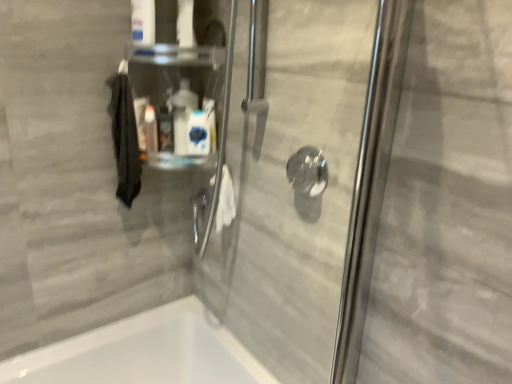
Question: From the image's perspective, is white glossy bottle at upper center, placed as the second cleaning product when sorted from right to left, over transparent glass shower handle at center?

Choices:
 (A) no
 (B) yes

Answer: (B)

Question: From the image's perspective, is white glossy bottle at upper center, placed as the second cleaning product when sorted from right to left, located beneath transparent glass shower handle at center?

Choices:
 (A) yes
 (B) no

Answer: (B)

Question: Are white glossy bottle at upper center, which ranks as the first cleaning product in left-to-right order, and transparent glass shower handle at center making contact?

Choices:
 (A) no
 (B) yes

Answer: (A)

Question: From a real-world perspective, does white glossy bottle at upper center, placed as the second cleaning product when sorted from right to left, sit lower than transparent glass shower handle at center?

Choices:
 (A) no
 (B) yes

Answer: (A)

Question: Is white glossy bottle at upper center, placed as the second cleaning product when sorted from right to left, positioned with its back to transparent glass shower handle at center?

Choices:
 (A) yes
 (B) no

Answer: (B)

Question: In terms of height, does white glossy bottle at center, which is the second cleaning product from left to right, look taller or shorter compared to black matte hand towel at left?

Choices:
 (A) tall
 (B) short

Answer: (B)

Question: Is point (188, 137) positioned closer to the camera than point (124, 168)?

Choices:
 (A) farther
 (B) closer

Answer: (B)

Question: Is white glossy bottle at center, the first cleaning product when ordered from right to left, bigger or smaller than black matte hand towel at left?

Choices:
 (A) small
 (B) big

Answer: (A)

Question: In the image, is white glossy bottle at center, which is the second cleaning product from left to right, on the left side or the right side of black matte hand towel at left?

Choices:
 (A) left
 (B) right

Answer: (B)

Question: Based on their sizes in the image, would you say transparent glass shower handle at center is bigger or smaller than white glossy bottle at center, the first cleaning product when ordered from right to left?

Choices:
 (A) small
 (B) big

Answer: (B)

Question: Is transparent glass shower handle at center wider or thinner than white glossy bottle at center, which is the second cleaning product from left to right?

Choices:
 (A) wide
 (B) thin

Answer: (A)

Question: Is transparent glass shower handle at center to the left or to the right of white glossy bottle at center, the first cleaning product when ordered from right to left, in the image?

Choices:
 (A) right
 (B) left

Answer: (A)

Question: Do you think transparent glass shower handle at center is within white glossy bottle at center, the first cleaning product when ordered from right to left, or outside of it?

Choices:
 (A) outside
 (B) inside

Answer: (A)

Question: In the image, is black matte hand towel at left positioned in front of or behind transparent glass shower handle at center?

Choices:
 (A) behind
 (B) front

Answer: (A)

Question: From the image's perspective, is black matte hand towel at left positioned above or below transparent glass shower handle at center?

Choices:
 (A) above
 (B) below

Answer: (A)